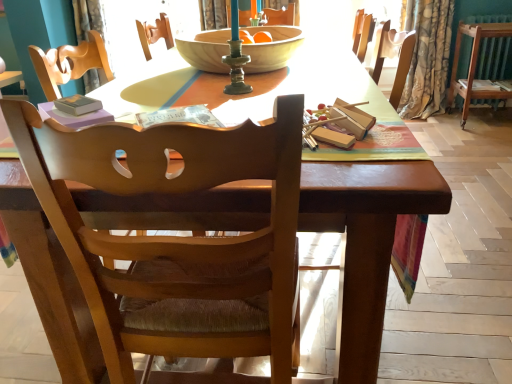
Question: From the image's perspective, would you say floral fabric curtain at right, arranged as the 2th curtain when viewed from the left, is shown under light beige fabric curtain at upper left, arranged as the 2th curtain when viewed from the right?

Choices:
 (A) yes
 (B) no

Answer: (A)

Question: Can you confirm if floral fabric curtain at right, positioned as the 1th curtain in right-to-left order, is thinner than light beige fabric curtain at upper left, arranged as the 2th curtain when viewed from the right?

Choices:
 (A) no
 (B) yes

Answer: (A)

Question: From a real-world perspective, is floral fabric curtain at right, arranged as the 2th curtain when viewed from the left, physically below light beige fabric curtain at upper left, arranged as the 2th curtain when viewed from the right?

Choices:
 (A) no
 (B) yes

Answer: (B)

Question: Is floral fabric curtain at right, arranged as the 2th curtain when viewed from the left, further to the viewer compared to light beige fabric curtain at upper left, which ranks as the 1th curtain in left-to-right order?

Choices:
 (A) yes
 (B) no

Answer: (B)

Question: From the image's perspective, would you say floral fabric curtain at right, arranged as the 2th curtain when viewed from the left, is positioned over light beige fabric curtain at upper left, arranged as the 2th curtain when viewed from the right?

Choices:
 (A) yes
 (B) no

Answer: (B)

Question: Are floral fabric curtain at right, arranged as the 2th curtain when viewed from the left, and light beige fabric curtain at upper left, arranged as the 2th curtain when viewed from the right, far apart?

Choices:
 (A) no
 (B) yes

Answer: (B)

Question: From a real-world perspective, does green metallic candle holder at center sit lower than floral fabric curtain at right, positioned as the 1th curtain in right-to-left order?

Choices:
 (A) yes
 (B) no

Answer: (B)

Question: Considering the relative positions of green metallic candle holder at center and floral fabric curtain at right, arranged as the 2th curtain when viewed from the left, in the image provided, is green metallic candle holder at center to the left of floral fabric curtain at right, arranged as the 2th curtain when viewed from the left, from the viewer's perspective?

Choices:
 (A) yes
 (B) no

Answer: (A)

Question: From the image's perspective, is green metallic candle holder at center on top of floral fabric curtain at right, positioned as the 1th curtain in right-to-left order?

Choices:
 (A) yes
 (B) no

Answer: (B)

Question: Would you say green metallic candle holder at center contains floral fabric curtain at right, positioned as the 1th curtain in right-to-left order?

Choices:
 (A) yes
 (B) no

Answer: (B)

Question: Is green metallic candle holder at center turned away from floral fabric curtain at right, positioned as the 1th curtain in right-to-left order?

Choices:
 (A) no
 (B) yes

Answer: (A)

Question: Is green metallic candle holder at center placed right next to floral fabric curtain at right, arranged as the 2th curtain when viewed from the left?

Choices:
 (A) yes
 (B) no

Answer: (B)

Question: From a real-world perspective, is matte purple paperback book at right, which is the 1th paperback book in right-to-left order, over hardcover book at upper left, arranged as the 1th paperback book when viewed from the left?

Choices:
 (A) no
 (B) yes

Answer: (A)